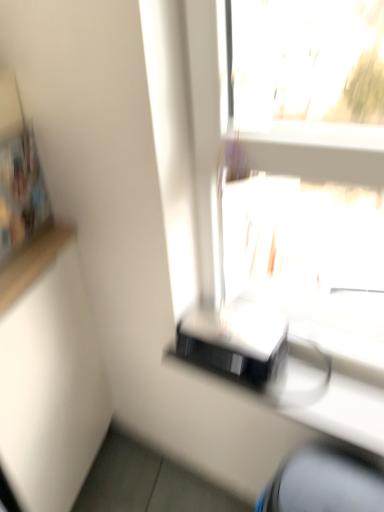
Question: Is blue fabric computer chair at lower right turned away from black glossy printer at lower right?

Choices:
 (A) no
 (B) yes

Answer: (A)

Question: Is blue fabric computer chair at lower right with black glossy printer at lower right?

Choices:
 (A) no
 (B) yes

Answer: (A)

Question: Is blue fabric computer chair at lower right further to the viewer compared to black glossy printer at lower right?

Choices:
 (A) no
 (B) yes

Answer: (A)

Question: Is blue fabric computer chair at lower right thinner than black glossy printer at lower right?

Choices:
 (A) yes
 (B) no

Answer: (B)

Question: From the image's perspective, is blue fabric computer chair at lower right below black glossy printer at lower right?

Choices:
 (A) no
 (B) yes

Answer: (B)

Question: From the image's perspective, would you say blue fabric computer chair at lower right is positioned over black glossy printer at lower right?

Choices:
 (A) yes
 (B) no

Answer: (B)

Question: From the image's perspective, is black glossy printer at lower right beneath blue fabric computer chair at lower right?

Choices:
 (A) yes
 (B) no

Answer: (B)

Question: Considering the relative sizes of black glossy printer at lower right and blue fabric computer chair at lower right in the image provided, is black glossy printer at lower right bigger than blue fabric computer chair at lower right?

Choices:
 (A) no
 (B) yes

Answer: (A)

Question: Is black glossy printer at lower right to the left of blue fabric computer chair at lower right from the viewer's perspective?

Choices:
 (A) yes
 (B) no

Answer: (A)

Question: Is black glossy printer at lower right to the right of blue fabric computer chair at lower right from the viewer's perspective?

Choices:
 (A) no
 (B) yes

Answer: (A)

Question: Is black glossy printer at lower right thinner than blue fabric computer chair at lower right?

Choices:
 (A) no
 (B) yes

Answer: (B)

Question: Is blue fabric computer chair at lower right completely or partially inside black glossy printer at lower right?

Choices:
 (A) yes
 (B) no

Answer: (B)

Question: Would you say blue fabric computer chair at lower right is inside or outside black glossy printer at lower right?

Choices:
 (A) inside
 (B) outside

Answer: (B)